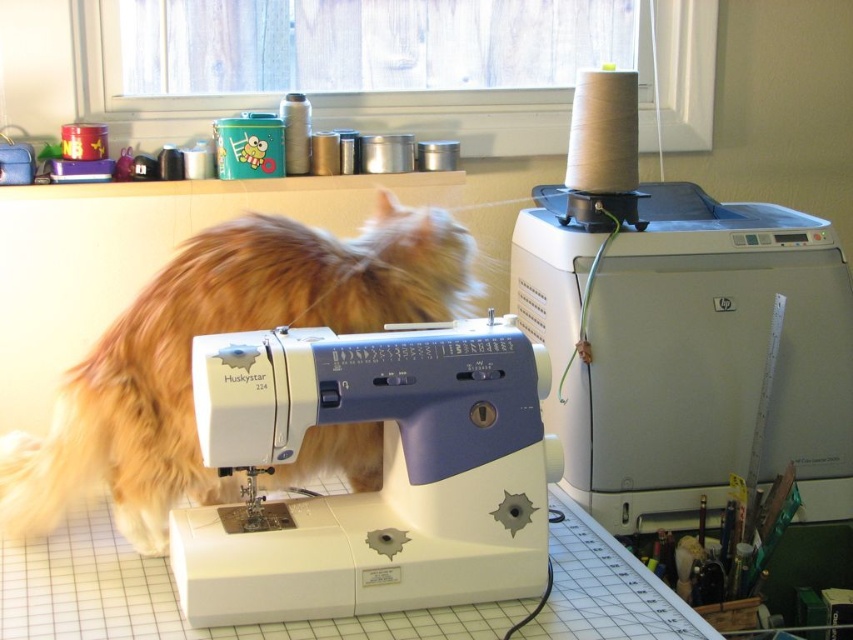
Question: Is white plastic sewing machine at center wider than fluffy orange fur at center?

Choices:
 (A) yes
 (B) no

Answer: (B)

Question: Which object is closer to the camera taking this photo?

Choices:
 (A) white plastic sewing machine at upper right
 (B) fluffy orange fur at center

Answer: (B)

Question: Which object appears farthest from the camera in this image?

Choices:
 (A) white plastic sewing machine at upper right
 (B) fluffy orange fur at center
 (C) white plastic sewing machine at center

Answer: (A)

Question: Which point is closer to the camera?

Choices:
 (A) fluffy orange fur at center
 (B) white plastic sewing machine at upper right

Answer: (A)

Question: From the image, what is the correct spatial relationship of white plastic sewing machine at upper right in relation to fluffy orange fur at center?

Choices:
 (A) below
 (B) above

Answer: (B)

Question: Does white plastic sewing machine at upper right appear over fluffy orange fur at center?

Choices:
 (A) no
 (B) yes

Answer: (B)